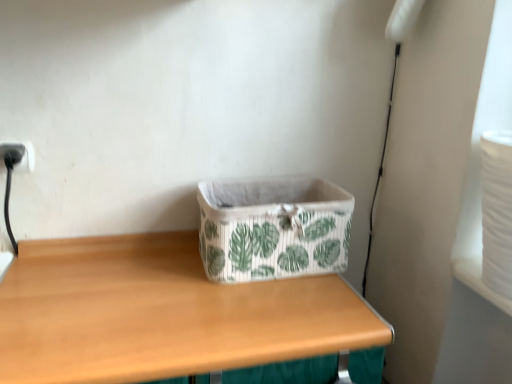
Question: Does wooden table at center have a greater height compared to white fabric storage box at center?

Choices:
 (A) yes
 (B) no

Answer: (A)

Question: Would you say wooden table at center contains white fabric storage box at center?

Choices:
 (A) no
 (B) yes

Answer: (A)

Question: Does wooden table at center have a smaller size compared to white fabric storage box at center?

Choices:
 (A) no
 (B) yes

Answer: (A)

Question: Considering the relative sizes of wooden table at center and white fabric storage box at center in the image provided, is wooden table at center wider than white fabric storage box at center?

Choices:
 (A) no
 (B) yes

Answer: (B)

Question: Is wooden table at center positioned with its back to white fabric storage box at center?

Choices:
 (A) no
 (B) yes

Answer: (A)

Question: From the image's perspective, relative to white fabric storage box at center, is wooden table at center above or below?

Choices:
 (A) below
 (B) above

Answer: (A)

Question: From a real-world perspective, is wooden table at center positioned above or below white fabric storage box at center?

Choices:
 (A) below
 (B) above

Answer: (A)

Question: Is point (234, 344) positioned closer to the camera than point (241, 190)?

Choices:
 (A) closer
 (B) farther

Answer: (A)

Question: Is wooden table at center wider or thinner than white fabric storage box at center?

Choices:
 (A) thin
 (B) wide

Answer: (B)

Question: From their relative heights in the image, would you say white fabric storage box at center is taller or shorter than wooden table at center?

Choices:
 (A) tall
 (B) short

Answer: (B)

Question: Looking at the image, does white fabric storage box at center seem bigger or smaller compared to wooden table at center?

Choices:
 (A) big
 (B) small

Answer: (B)

Question: Considering their positions, is white fabric storage box at center located in front of or behind wooden table at center?

Choices:
 (A) behind
 (B) front

Answer: (A)

Question: Is white fabric storage box at center wider or thinner than wooden table at center?

Choices:
 (A) wide
 (B) thin

Answer: (B)

Question: Is wooden table at center wider or thinner than black plastic electric outlet at upper left?

Choices:
 (A) wide
 (B) thin

Answer: (A)

Question: Considering their positions, is wooden table at center located in front of or behind black plastic electric outlet at upper left?

Choices:
 (A) behind
 (B) front

Answer: (B)